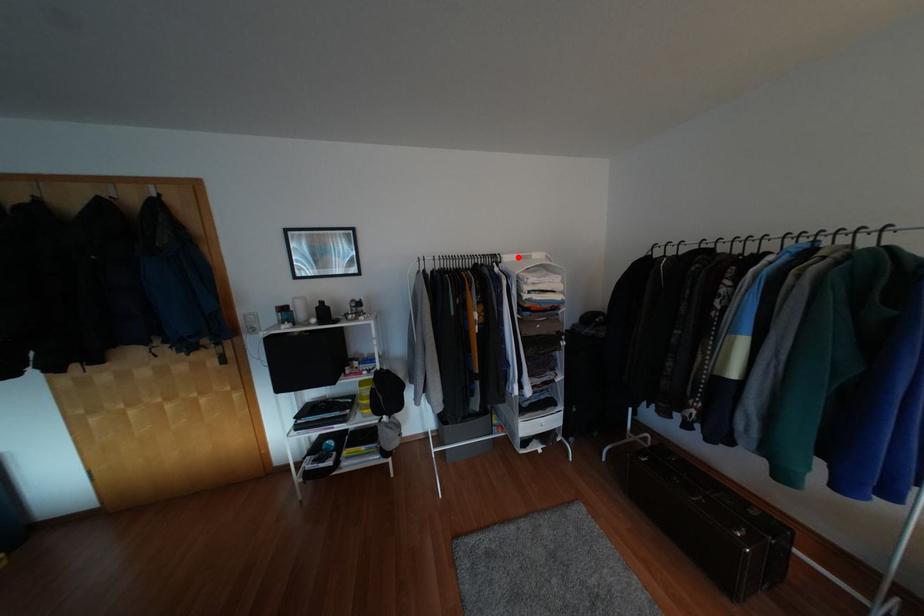
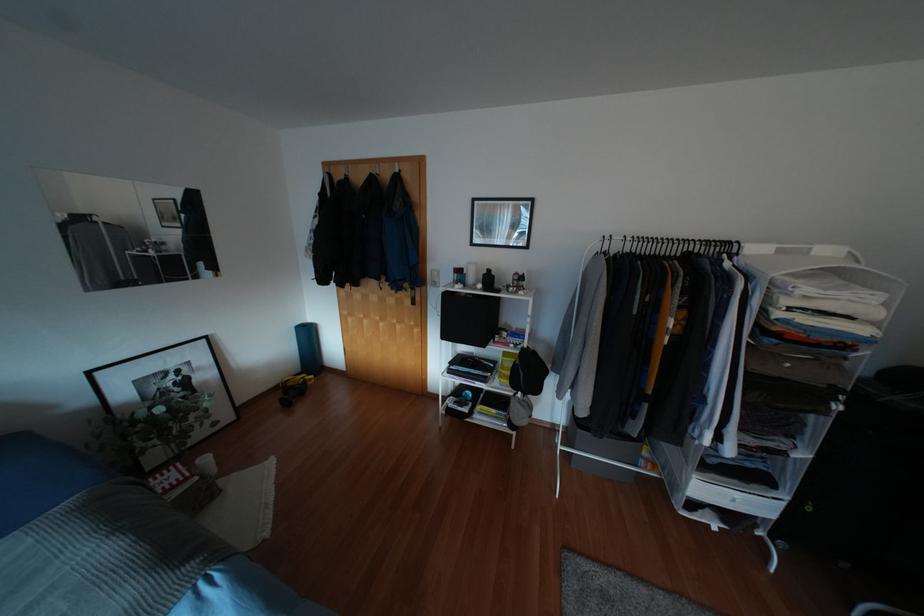
Locate, in the second image, the point that corresponds to the highlighted location in the first image.

(779, 251)